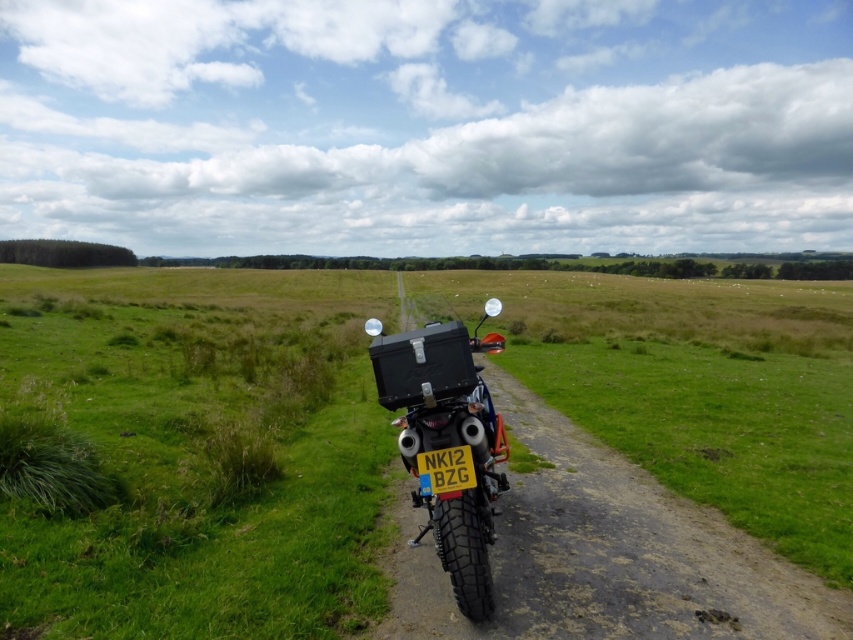
Based on the photo, you are a photographer planning to take a picture of the black textured motorcycle at center and the yellow matte license plate at center. Since you want both objects to be clearly visible in your photo, which object should you focus on first if you are moving from left to right along the path?

The black textured motorcycle at center is to the left of the yellow matte license plate at center, so you should focus on the black textured motorcycle at center first as you move from left to right along the path.

You are standing at the motorcycle and looking along the dirt path. There are two points marked on the path ahead of you. The first point is at coordinates point [111,467] and the second point is at point [416,460]. Which point is closer to you?

Point [111,467] is closer to you because it is further to the camera than point [416,460].